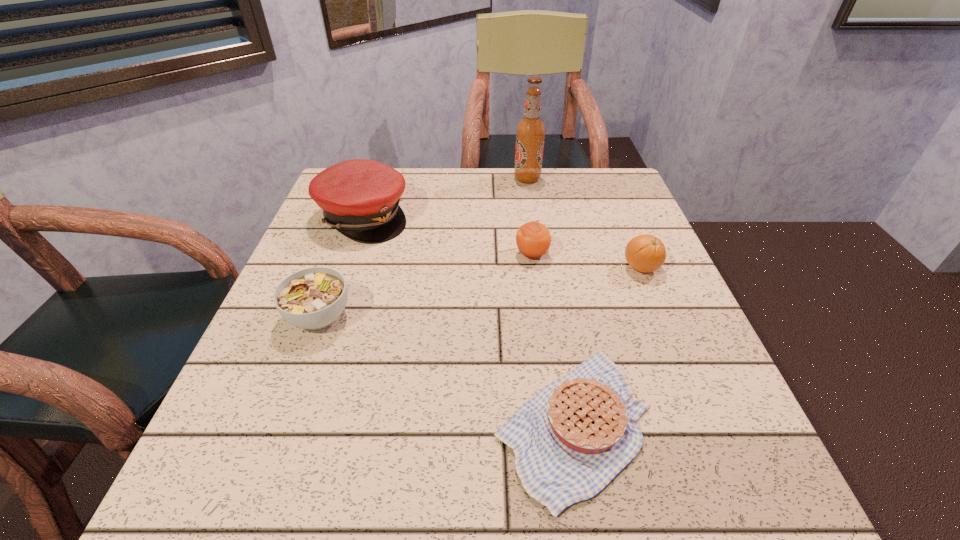
You are a GUI agent. You are given a task and a screenshot of the screen. Output one action in this format:
    pyautogui.click(x=<x>, y=<y>)
    Task: Click on the free spot between the left orange and the rightmost object
    
    Given the screenshot: What is the action you would take?
    pyautogui.click(x=587, y=261)

Locate an element on the screen. vacant area that lies between the left orange and the rightmost object is located at coordinates (587, 261).

This screenshot has width=960, height=540. I want to click on free spot between the cap and the shortest object, so click(468, 321).

Where is `free spot between the pie and the right orange`? free spot between the pie and the right orange is located at coordinates (607, 346).

Find the location of a particular element. empty space between the left orange and the cap is located at coordinates (447, 235).

You are a GUI agent. You are given a task and a screenshot of the screen. Output one action in this format:
    pyautogui.click(x=<x>, y=<y>)
    Task: Click on the empty space that is in between the shortest object and the left orange
    This screenshot has height=540, width=960.
    Given the screenshot: What is the action you would take?
    pyautogui.click(x=553, y=339)

Locate an element on the screen. free space between the rightmost object and the nearest object is located at coordinates (607, 346).

I want to click on empty location between the right orange and the second tallest object, so click(502, 242).

Image resolution: width=960 pixels, height=540 pixels. I want to click on vacant space in between the tallest object and the pie, so click(x=550, y=301).

Find the location of `vacant area between the left orange and the nearest object`. vacant area between the left orange and the nearest object is located at coordinates (553, 339).